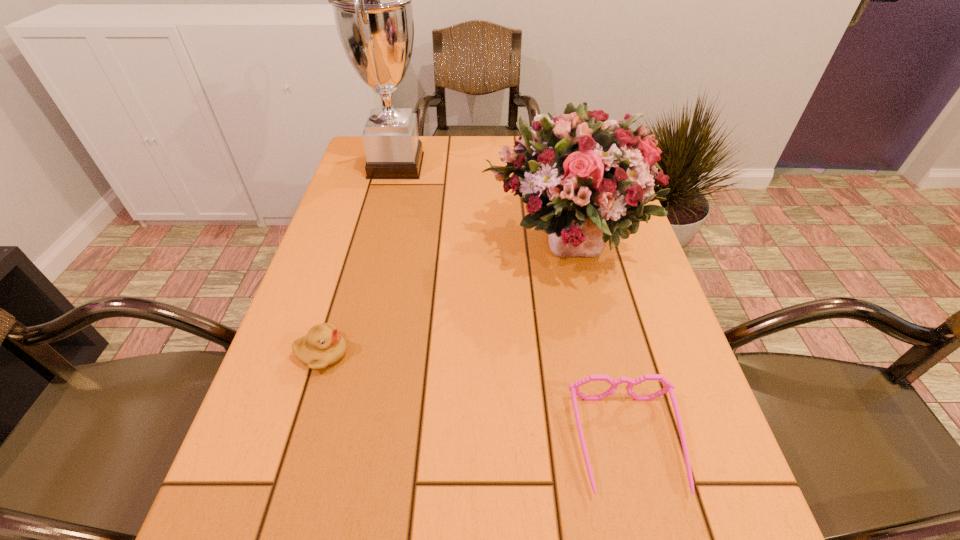
I want to click on free region that satisfies the following two spatial constraints: 1. at the front view of the trophy cup; 2. on the left side of the third nearest object, so click(376, 243).